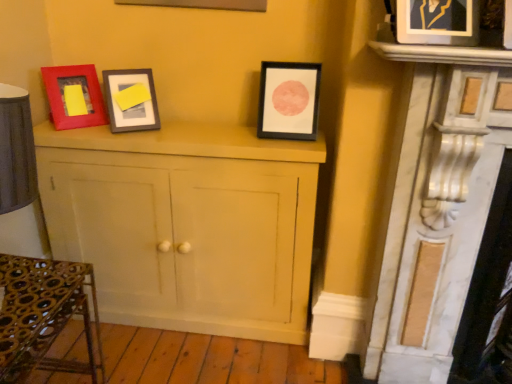
Question: Is black matte picture frame at center, arranged as the 1th picture frame when viewed from the left, at the right side of matte white cabinet at center?

Choices:
 (A) yes
 (B) no

Answer: (A)

Question: Can you confirm if black matte picture frame at center, the second picture frame when ordered from right to left, is shorter than matte white cabinet at center?

Choices:
 (A) yes
 (B) no

Answer: (A)

Question: From a real-world perspective, does black matte picture frame at center, arranged as the 1th picture frame when viewed from the back, sit lower than matte white cabinet at center?

Choices:
 (A) no
 (B) yes

Answer: (A)

Question: Is black matte picture frame at center, the second picture frame when ordered from right to left, oriented away from matte white cabinet at center?

Choices:
 (A) no
 (B) yes

Answer: (A)

Question: From a real-world perspective, is black matte picture frame at center, arranged as the 1th picture frame when viewed from the left, located higher than matte white cabinet at center?

Choices:
 (A) no
 (B) yes

Answer: (B)

Question: Considering the positions of metallic gold picture frame at upper right, which is the 2th picture frame from left to right, and metallic wrought iron table at lower left in the image, is metallic gold picture frame at upper right, which is the 2th picture frame from left to right, taller or shorter than metallic wrought iron table at lower left?

Choices:
 (A) short
 (B) tall

Answer: (A)

Question: In the image, is metallic gold picture frame at upper right, which ranks as the second picture frame in back-to-front order, on the left side or the right side of metallic wrought iron table at lower left?

Choices:
 (A) right
 (B) left

Answer: (A)

Question: From a real-world perspective, is metallic gold picture frame at upper right, which ranks as the second picture frame in back-to-front order, above or below metallic wrought iron table at lower left?

Choices:
 (A) below
 (B) above

Answer: (B)

Question: Relative to metallic wrought iron table at lower left, is metallic gold picture frame at upper right, the 1th picture frame positioned from the right, in front or behind?

Choices:
 (A) behind
 (B) front

Answer: (A)

Question: Is metallic wrought iron table at lower left spatially inside white marble fireplace at right, or outside of it?

Choices:
 (A) inside
 (B) outside

Answer: (B)

Question: From the image's perspective, is metallic wrought iron table at lower left positioned above or below white marble fireplace at right?

Choices:
 (A) above
 (B) below

Answer: (B)

Question: Is metallic wrought iron table at lower left wider or thinner than white marble fireplace at right?

Choices:
 (A) thin
 (B) wide

Answer: (B)

Question: In terms of height, does metallic wrought iron table at lower left look taller or shorter compared to white marble fireplace at right?

Choices:
 (A) tall
 (B) short

Answer: (B)

Question: From a real-world perspective, is black matte picture frame at center, arranged as the 1th picture frame when viewed from the left, above or below white marble fireplace at right?

Choices:
 (A) below
 (B) above

Answer: (B)

Question: Which is correct: black matte picture frame at center, the second picture frame when ordered from right to left, is inside white marble fireplace at right, or outside of it?

Choices:
 (A) outside
 (B) inside

Answer: (A)